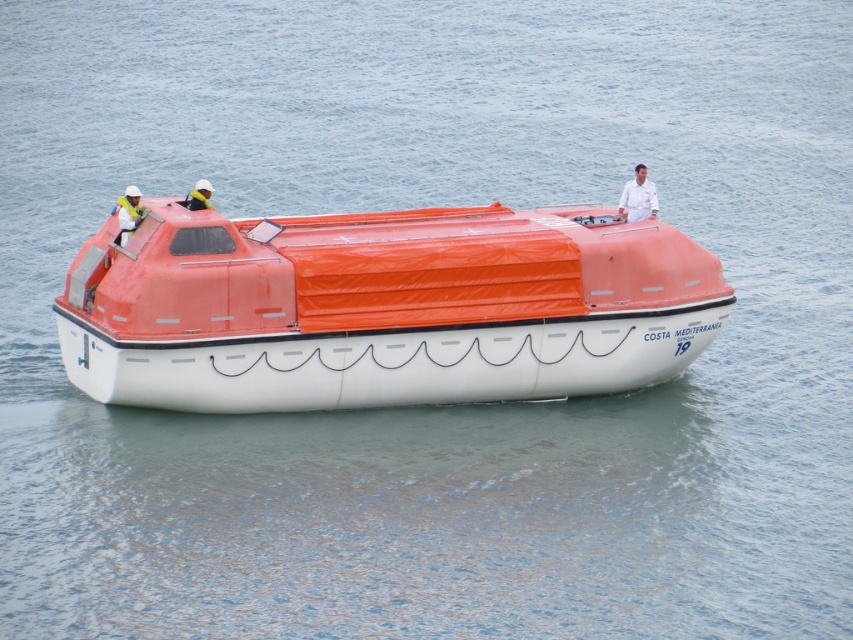
Question: Which point is closer to the camera?

Choices:
 (A) white matte life vest at left
 (B) orange matte lifeboat at center

Answer: (B)

Question: Which point is farther from the camera taking this photo?

Choices:
 (A) (135, 189)
 (B) (189, 198)
 (C) (521, 266)
 (D) (633, 196)

Answer: (D)

Question: From the image, what is the correct spatial relationship of white matte shirt at upper center in relation to yellow life vest at upper center?

Choices:
 (A) right
 (B) left

Answer: (A)

Question: Is orange matte lifeboat at center below yellow life vest at upper center?

Choices:
 (A) yes
 (B) no

Answer: (A)

Question: Does white matte life vest at left appear on the right side of yellow life vest at upper center?

Choices:
 (A) yes
 (B) no

Answer: (B)

Question: Which point is farther from the camera taking this photo?

Choices:
 (A) (132, 220)
 (B) (648, 204)
 (C) (537, 253)
 (D) (206, 205)

Answer: (B)